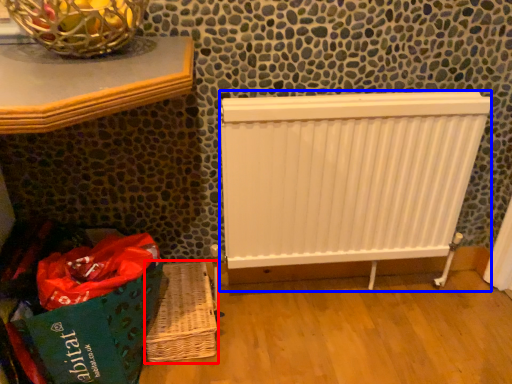
Question: Which of the following is the farthest to the observer, basket (highlighted by a red box) or radiator (highlighted by a blue box)?

Choices:
 (A) basket
 (B) radiator

Answer: (A)